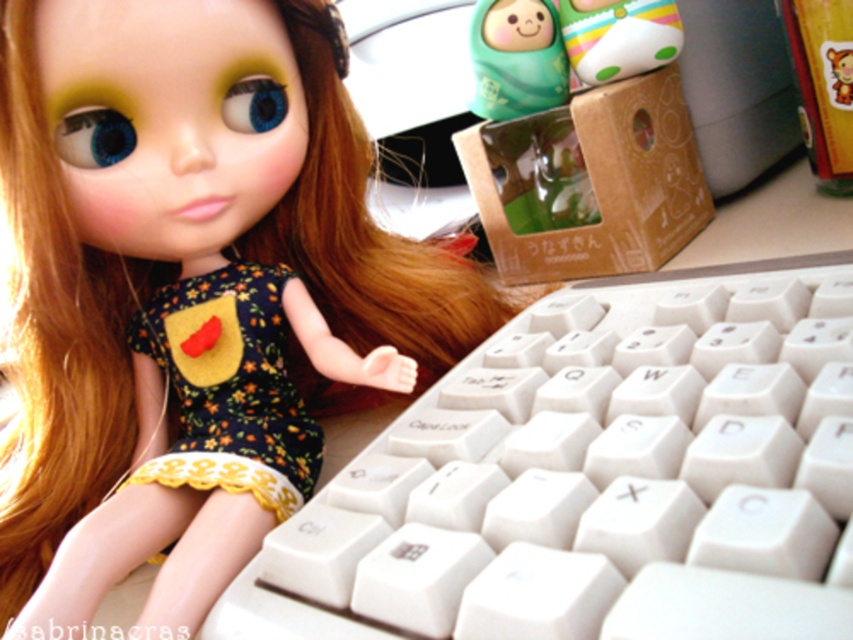
Which is behind, point (148, 195) or point (196, 474)?

The point (148, 195) is more distant.

From the picture: Which is above, matte black doll at upper left or floral fabric dress at center?

matte black doll at upper left is higher up.

Identify the location of matte black doll at upper left. [190, 291].

Is white plastic keyboard at center shorter than floral fabric dress at center?

No, white plastic keyboard at center is not shorter than floral fabric dress at center.

Image resolution: width=853 pixels, height=640 pixels. I want to click on white plastic keyboard at center, so click(596, 477).

Does point (715, 301) lie in front of point (633, 48)?

That is True.

Looking at this image, who is more forward, (x=396, y=532) or (x=664, y=28)?

Point (x=396, y=532) is in front.

I want to click on white plastic keyboard at center, so click(596, 477).